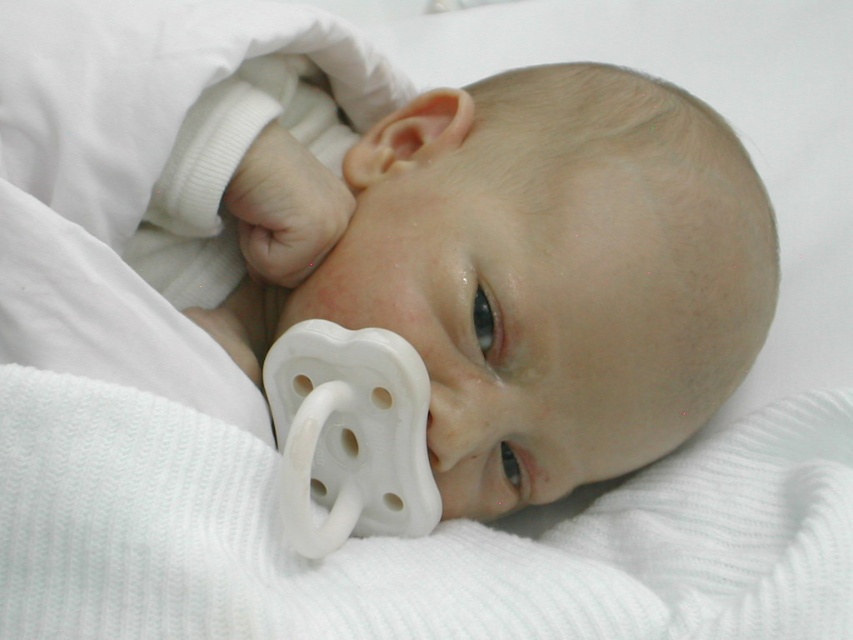
You are a photographer setting up for a baby photo shoot. The baby is lying on a soft surface with a white ribbed blanket at center. You want to focus on the baby while ensuring the blanket is still visible in the frame. Based on the distance, will the blanket be in focus if you set your camera to focus on the baby?

The white ribbed blanket at center is 22.06 inches away from the camera. If the camera is focused on the baby, the blanket will likely be in focus as it is at the same distance as the baby, assuming the depth of field is sufficient.

You are a photographer trying to capture a close shot of the baby. You need to focus on the white ribbed blanket at center and the white rubber pacifier at center. Which object should you adjust your focus on first if you want to ensure both are in focus, considering their size in the frame?

The white ribbed blanket at center is taller than the white rubber pacifier at center, so you should focus on the white ribbed blanket at center first as it occupies more space in the frame.

You are a photographer positioned at the center of the room. You need to capture a close shot of the white ribbed blanket at center. Based on its position, which direction should you move to get closer to it?

The white ribbed blanket at center is located at point (x=405, y=540), so you should move towards the lower right direction to get closer to it.